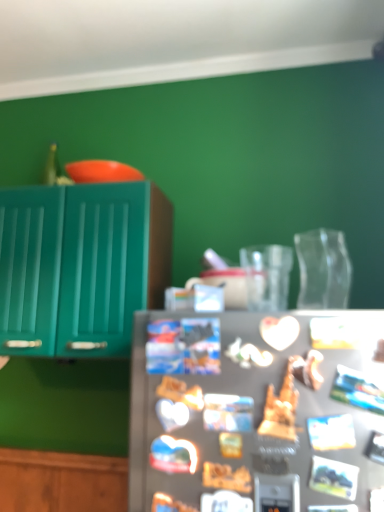
What is the approximate width of satin silver refrigerator at center?

satin silver refrigerator at center is 0.82 inches in width.

You are a GUI agent. You are given a task and a screenshot of the screen. Output one action in this format:
    pyautogui.click(x=<x>, y=<y>)
    Task: Click on the satin silver fridge at center
    
    Given the screenshot: What is the action you would take?
    pyautogui.click(x=255, y=410)

Where is `satin silver refrigerator at center`? The height and width of the screenshot is (512, 384). satin silver refrigerator at center is located at coordinates (276, 493).

Is teal glossy cabinet at left far from satin silver fridge at center?

No, teal glossy cabinet at left is not far from satin silver fridge at center.

Based on the photo, is teal glossy cabinet at left positioned before satin silver fridge at center?

That is False.

Could you tell me if teal glossy cabinet at left is facing satin silver fridge at center?

No, teal glossy cabinet at left does not turn towards satin silver fridge at center.

Consider the image. From the image's perspective, is teal glossy cabinet at left positioned above or below satin silver fridge at center?

From the image's perspective, teal glossy cabinet at left appears above satin silver fridge at center.

Is satin silver refrigerator at center oriented towards teal glossy cabinet at left?

No, satin silver refrigerator at center is not turned towards teal glossy cabinet at left.

Is satin silver refrigerator at center taller than teal glossy cabinet at left?

No.

From the image's perspective, which is below, satin silver refrigerator at center or teal glossy cabinet at left?

satin silver refrigerator at center, from the image's perspective.

Considering the sizes of objects satin silver refrigerator at center and teal glossy cabinet at left in the image provided, who is smaller, satin silver refrigerator at center or teal glossy cabinet at left?

With smaller size is satin silver refrigerator at center.

Is teal glossy cabinet at left aimed at satin silver refrigerator at center?

No, teal glossy cabinet at left is not aimed at satin silver refrigerator at center.

From the image's perspective, who appears lower, teal glossy cabinet at left or satin silver refrigerator at center?

From the image's view, satin silver refrigerator at center is below.

Does point (108, 246) come farther from viewer compared to point (272, 480)?

Yes, point (108, 246) is behind point (272, 480).

Can you tell me how much teal glossy cabinet at left and satin silver refrigerator at center differ in facing direction?

The angular difference between teal glossy cabinet at left and satin silver refrigerator at center is 3.38 degrees.

Visually, is satin silver fridge at center positioned to the left or to the right of teal glossy cabinet at left?

In the image, satin silver fridge at center appears on the right side of teal glossy cabinet at left.

Find the location of a particular element. The height and width of the screenshot is (512, 384). cabinetry above the satin silver fridge at center (from the image's perspective) is located at coordinates (83, 268).

Which is in front, satin silver fridge at center or teal glossy cabinet at left?

satin silver fridge at center is more forward.

Considering the positions of point (193, 355) and point (103, 354), is point (193, 355) closer or farther from the camera than point (103, 354)?

Point (193, 355).

Is satin silver refrigerator at center located outside satin silver fridge at center?

No, satin silver refrigerator at center is not outside of satin silver fridge at center.

Looking at this image, which object is further away from the camera taking this photo, satin silver refrigerator at center or satin silver fridge at center?

satin silver refrigerator at center is further from the camera.

In the image, is satin silver refrigerator at center on the left side or the right side of satin silver fridge at center?

From the image, it's evident that satin silver refrigerator at center is to the right of satin silver fridge at center.

Identify the location of refrigerator located in front of the satin silver refrigerator at center. [255, 410].

In the scene shown: Is satin silver fridge at center taller or shorter than satin silver refrigerator at center?

In the image, satin silver fridge at center appears to be taller than satin silver refrigerator at center.

Considering the sizes of objects satin silver fridge at center and satin silver refrigerator at center in the image provided, who is smaller, satin silver fridge at center or satin silver refrigerator at center?

Smaller between the two is satin silver refrigerator at center.

Identify the location of cabinetry that appears behind the satin silver fridge at center. This screenshot has width=384, height=512. (83, 268).

I want to click on cabinetry above the satin silver refrigerator at center (from the image's perspective), so click(83, 268).

Which object lies further to the anchor point satin silver refrigerator at center, teal glossy cabinet at left or satin silver fridge at center?

The object further to satin silver refrigerator at center is teal glossy cabinet at left.

Looking at the image, which one is located closer to satin silver fridge at center, teal glossy cabinet at left or satin silver refrigerator at center?

satin silver refrigerator at center is positioned closer to the anchor satin silver fridge at center.

Looking at this image, considering their positions, is satin silver refrigerator at center positioned closer to satin silver fridge at center than teal glossy cabinet at left?

satin silver refrigerator at center.

Estimate the real-world distances between objects in this image. Which object is closer to teal glossy cabinet at left, satin silver fridge at center or satin silver refrigerator at center?

The object closer to teal glossy cabinet at left is satin silver fridge at center.

Based on their spatial positions, is satin silver refrigerator at center or satin silver fridge at center further from teal glossy cabinet at left?

Based on the image, satin silver refrigerator at center appears to be further to teal glossy cabinet at left.

From the image, which object appears to be nearer to satin silver refrigerator at center, satin silver fridge at center or teal glossy cabinet at left?

Among the two, satin silver fridge at center is located nearer to satin silver refrigerator at center.

Identify the location of appliance between satin silver fridge at center and teal glossy cabinet at left from front to back. (276, 493).